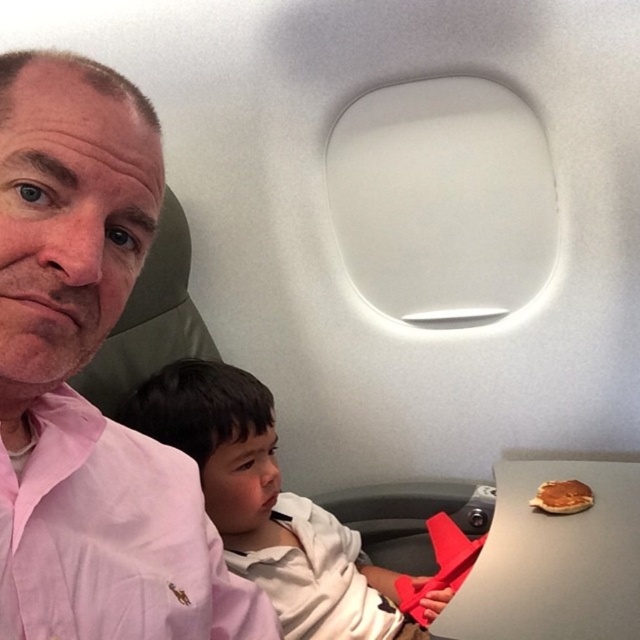
You are a flight attendant checking seat assignments. You notice two passengers seated next to each other. The first is wearing a pink fabric shirt at left, and the second is wearing a white cotton shirt at center. Which passenger is wearing a smaller shirt?

The pink fabric shirt at left has a smaller size compared to the white cotton shirt at center, so the passenger wearing the pink fabric shirt at left is wearing the smaller shirt.

You are sitting in an airplane seat and notice two shirts in front of you. The pink cotton shirt at left and the white cotton shirt at center. Which shirt is positioned more to the left side?

The pink cotton shirt at left is positioned more to the left side than the white cotton shirt at center.